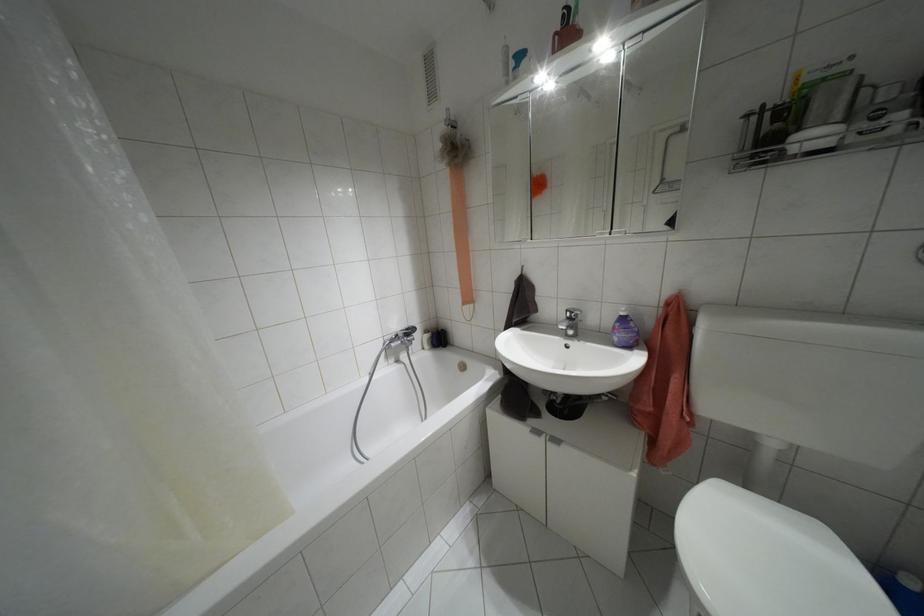
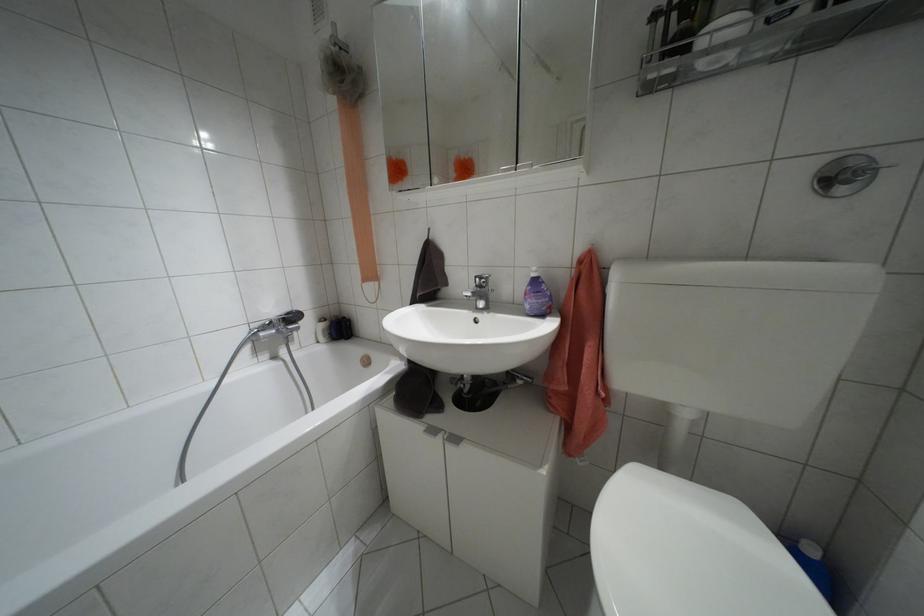
Where in the second image is the point corresponding to [569,318] from the first image?

(479, 286)